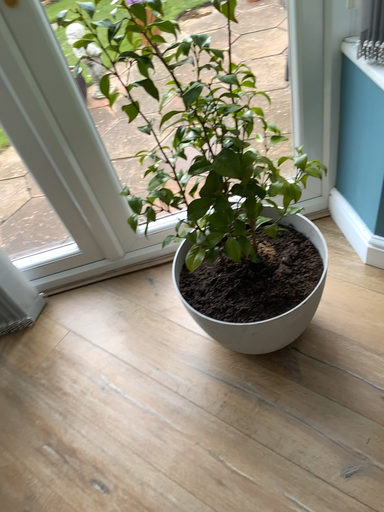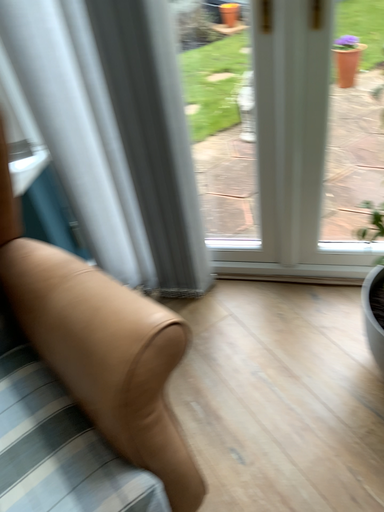
Question: Which way did the camera rotate in the video?

Choices:
 (A) rotated left
 (B) rotated right

Answer: (A)